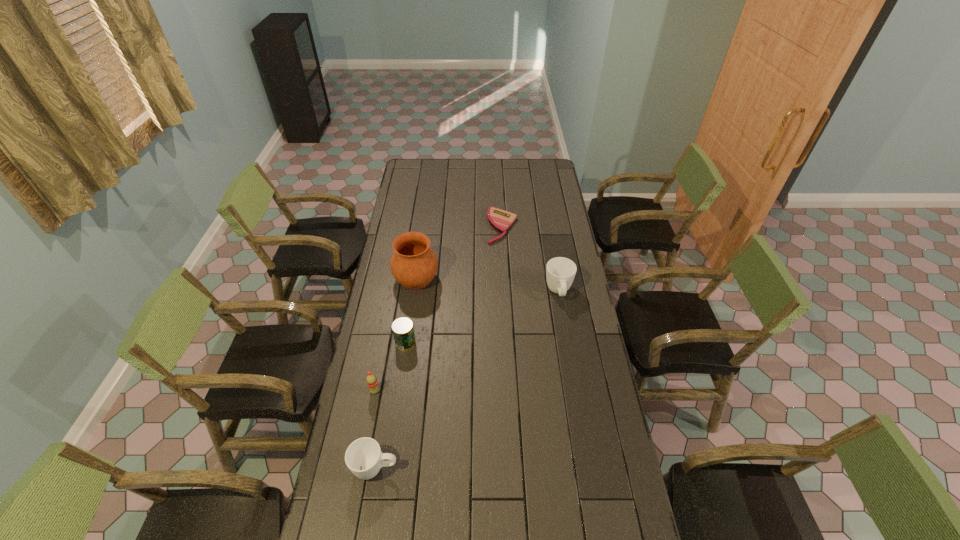
Locate an element on the screen. free space at the far edge of the desktop is located at coordinates (502, 169).

The width and height of the screenshot is (960, 540). In the image, there is a desktop. Identify the location of vacant space at the left edge. (419, 204).

Locate an element on the screen. Image resolution: width=960 pixels, height=540 pixels. vacant region at the right edge of the desktop is located at coordinates (609, 456).

This screenshot has height=540, width=960. In order to click on vacant area at the far left corner in this screenshot , I will do (415, 165).

In the image, there is a desktop. What are the coordinates of `vacant space at the far right corner` in the screenshot? It's located at (539, 176).

Image resolution: width=960 pixels, height=540 pixels. What are the coordinates of `vacant point located between the fourth farthest object and the tallest object` in the screenshot? It's located at (411, 310).

Locate an element on the screen. The image size is (960, 540). free space between the second object from right to left and the farther cup is located at coordinates (531, 259).

At what (x,y) coordinates should I click in order to perform the action: click on free space between the rightmost object and the soda. Please return your answer as a coordinate pair (x, y). The image size is (960, 540). Looking at the image, I should click on (467, 342).

The image size is (960, 540). In order to click on empty space that is in between the soda and the nearer cup in this screenshot , I will do `click(375, 430)`.

Where is `vacant point located between the fourth farthest object and the farthest object`? Image resolution: width=960 pixels, height=540 pixels. vacant point located between the fourth farthest object and the farthest object is located at coordinates (454, 285).